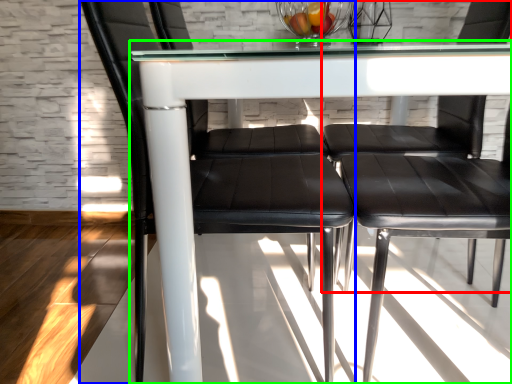
Question: Which is farther away from chair (highlighted by a red box)? chair (highlighted by a blue box) or table (highlighted by a green box)?

Choices:
 (A) chair
 (B) table

Answer: (B)